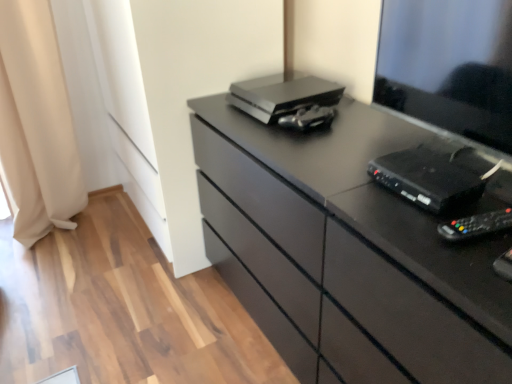
You are a GUI agent. You are given a task and a screenshot of the screen. Output one action in this format:
    pyautogui.click(x=<x>, y=<y>)
    Task: Click on the vacant area that is in front of satin silver printer at upper center
    
    Given the screenshot: What is the action you would take?
    pyautogui.click(x=295, y=133)